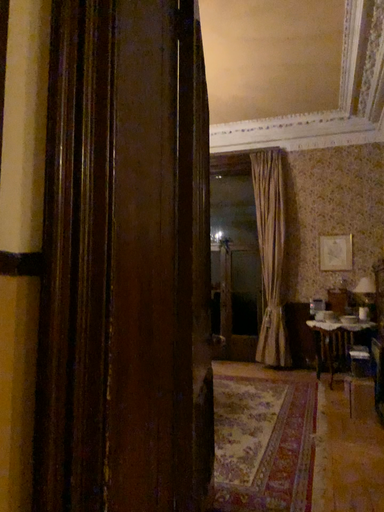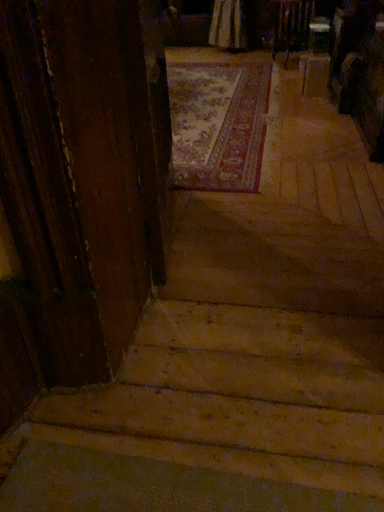
Question: Which way did the camera rotate in the video?

Choices:
 (A) rotated downward
 (B) rotated upward

Answer: (A)